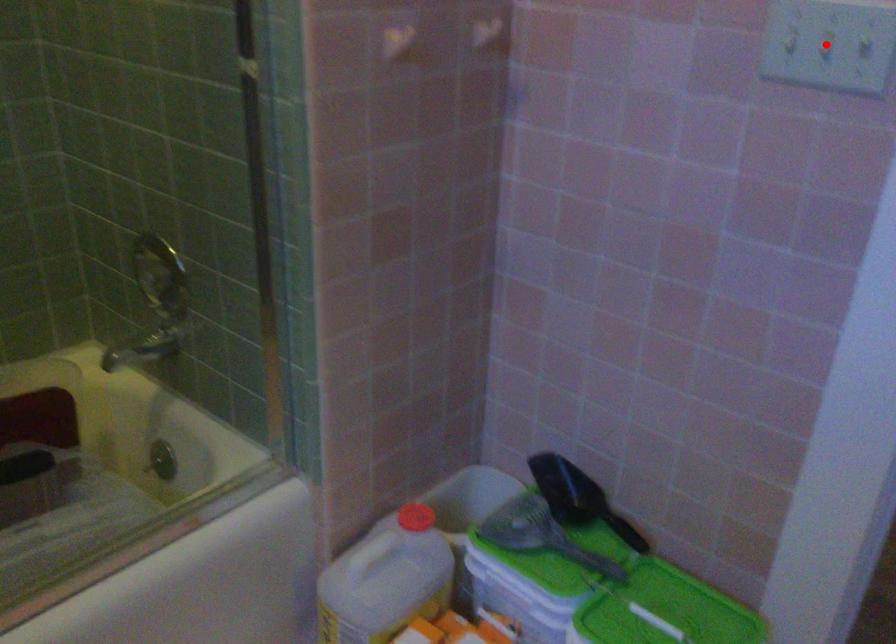
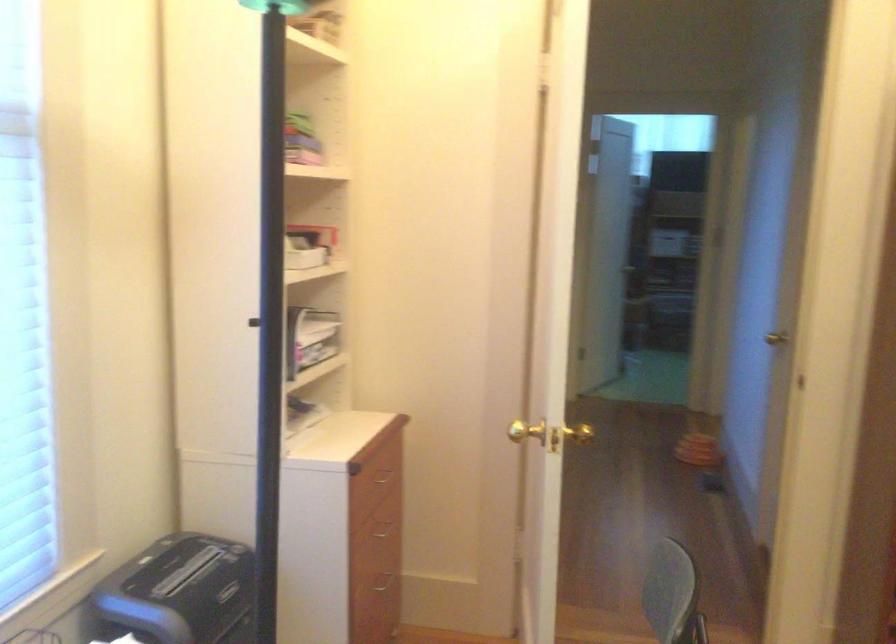
Question: I am providing you with two images of the same scene from different viewpoints. A red point is marked on the first image. Can you still see the location of the red point in image 2?

Choices:
 (A) Yes
 (B) No

Answer: (B)